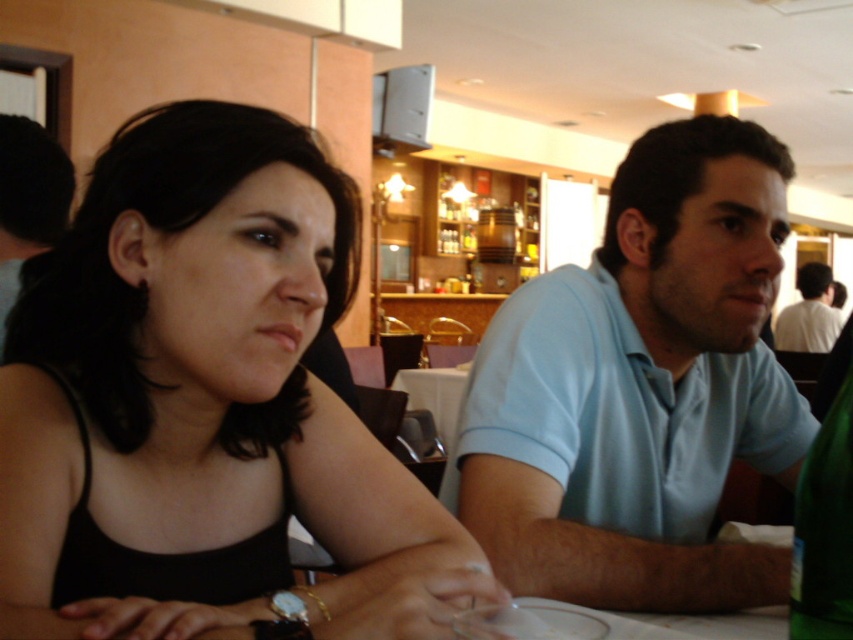
You are a fashion designer observing two outfits in the image. The black matte tank top at center and the white shirt at upper right. Which of the two outfits has a narrower width?

The black matte tank top at center has a lesser width compared to the white shirt at upper right, so the black matte tank top at center is narrower.

You are a photographer taking a picture of the light blue cotton shirt at center and the white shirt at upper right. Which shirt will appear larger in the photo?

The light blue cotton shirt at center will appear larger in the photo because it is closer to the viewer than the white shirt at upper right.